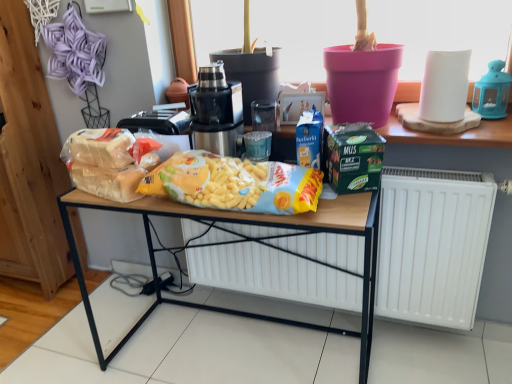
Question: From a real-world perspective, is green matte lunch box at center located beneath wooden shelf at upper center?

Choices:
 (A) no
 (B) yes

Answer: (A)

Question: Does green matte lunch box at center touch wooden shelf at upper center?

Choices:
 (A) yes
 (B) no

Answer: (B)

Question: From a real-world perspective, does green matte lunch box at center stand above wooden shelf at upper center?

Choices:
 (A) yes
 (B) no

Answer: (A)

Question: Is green matte lunch box at center thinner than wooden shelf at upper center?

Choices:
 (A) no
 (B) yes

Answer: (B)

Question: Is wooden shelf at upper center surrounded by green matte lunch box at center?

Choices:
 (A) yes
 (B) no

Answer: (B)

Question: From their relative heights in the image, would you say yellow matte snack packet at center, which is the 2th waste from left to right, is taller or shorter than green matte lunch box at center?

Choices:
 (A) short
 (B) tall

Answer: (A)

Question: Looking at their shapes, would you say yellow matte snack packet at center, which is the 2th waste from left to right, is wider or thinner than green matte lunch box at center?

Choices:
 (A) wide
 (B) thin

Answer: (A)

Question: From a real-world perspective, is yellow matte snack packet at center, which is the 2th waste from left to right, physically located above or below green matte lunch box at center?

Choices:
 (A) below
 (B) above

Answer: (A)

Question: In the image, is yellow matte snack packet at center, the 1th waste when ordered from right to left, positioned in front of or behind green matte lunch box at center?

Choices:
 (A) front
 (B) behind

Answer: (A)

Question: Is point pyautogui.click(x=236, y=140) closer or farther from the camera than point pyautogui.click(x=186, y=193)?

Choices:
 (A) farther
 (B) closer

Answer: (A)

Question: From a real-world perspective, is black metallic juicer at center above or below yellow matte snack packet at center, the 1th waste when ordered from right to left?

Choices:
 (A) above
 (B) below

Answer: (A)

Question: In terms of size, does black metallic juicer at center appear bigger or smaller than yellow matte snack packet at center, which is the 2th waste from left to right?

Choices:
 (A) big
 (B) small

Answer: (A)

Question: Is black metallic juicer at center inside the boundaries of yellow matte snack packet at center, the 1th waste when ordered from right to left, or outside?

Choices:
 (A) outside
 (B) inside

Answer: (A)

Question: Is translucent plastic bag at center, the first waste from the left, bigger or smaller than yellow matte snack packet at center, which is the 2th waste from left to right?

Choices:
 (A) big
 (B) small

Answer: (B)

Question: Choose the correct answer: Is translucent plastic bag at center, the 2th waste viewed from the right, inside yellow matte snack packet at center, which is the 2th waste from left to right, or outside it?

Choices:
 (A) outside
 (B) inside

Answer: (A)